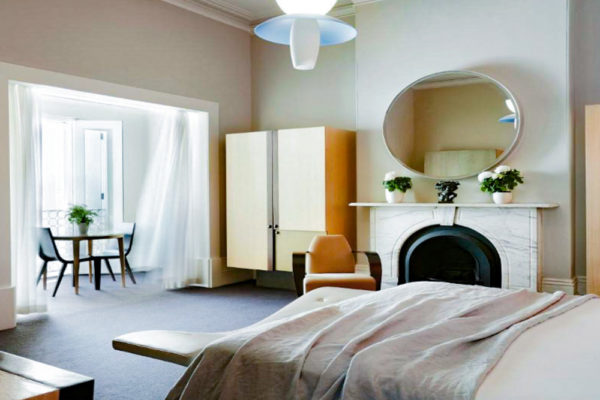
Find the location of `curtain`. curtain is located at coordinates (176, 184).